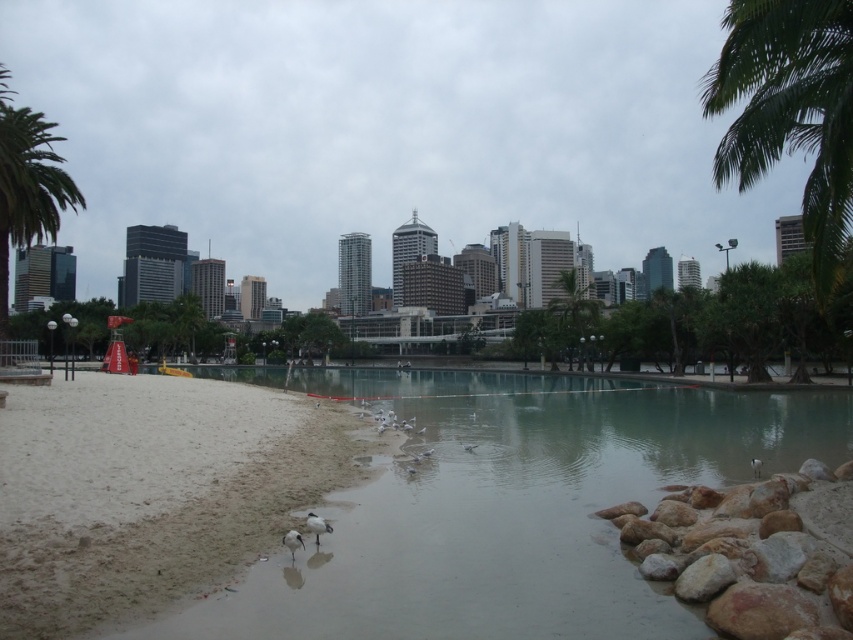
Question: Based on their relative distances, which object is farther from the green leafy palm tree at left?

Choices:
 (A) white sandy beach at lower left
 (B) green leafy palm tree at center
 (C) green leafy palm tree at upper right

Answer: (C)

Question: Considering the real-world distances, which object is closest to the green leafy palm tree at upper right?

Choices:
 (A) green leafy palm tree at left
 (B) green leafy palm tree at center
 (C) white sandy beach at lower left

Answer: (C)

Question: Is green leafy palm tree at upper right positioned at the back of green leafy palm tree at center?

Choices:
 (A) yes
 (B) no

Answer: (B)

Question: Can you confirm if white sandy beach at lower left is wider than green leafy palm tree at upper right?

Choices:
 (A) yes
 (B) no

Answer: (B)

Question: Based on their relative distances, which object is farther from the green leafy palm tree at upper right?

Choices:
 (A) green leafy palm tree at center
 (B) green leafy palm tree at left

Answer: (B)

Question: Does green leafy palm tree at upper right appear over green leafy palm tree at left?

Choices:
 (A) yes
 (B) no

Answer: (B)